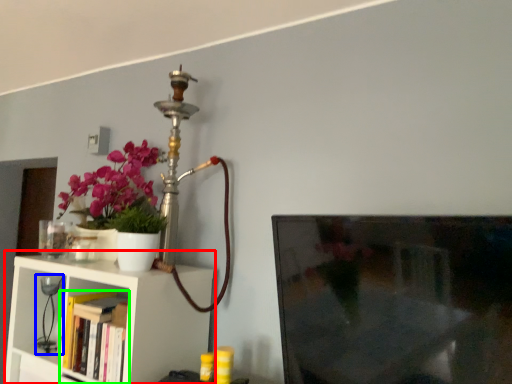
Question: Which object is positioned farthest from shelf (highlighted by a red box)? Select from table lamp (highlighted by a blue box) and book (highlighted by a green box).

Choices:
 (A) table lamp
 (B) book

Answer: (A)